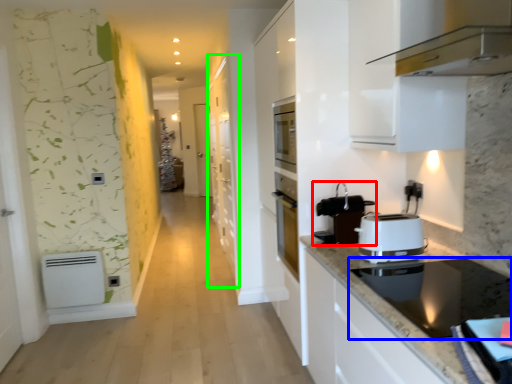
Question: Based on their relative distances, which object is nearer to kitchen appliance (highlighted by a red box)? Choose from home appliance (highlighted by a blue box) and cabinetry (highlighted by a green box).

Choices:
 (A) home appliance
 (B) cabinetry

Answer: (A)